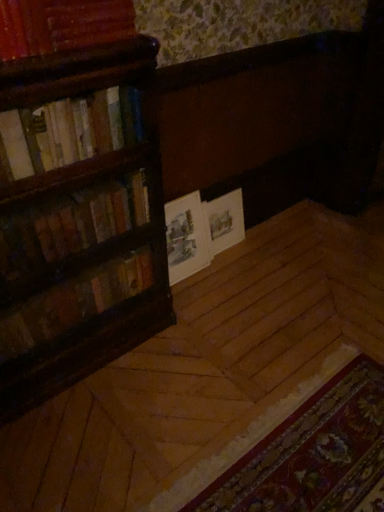
Where is `blank space situated above hardcover books at left, arranged as the 2th book when viewed from the top (from a real-world perspective)`? The width and height of the screenshot is (384, 512). blank space situated above hardcover books at left, arranged as the 2th book when viewed from the top (from a real-world perspective) is located at coordinates (58, 95).